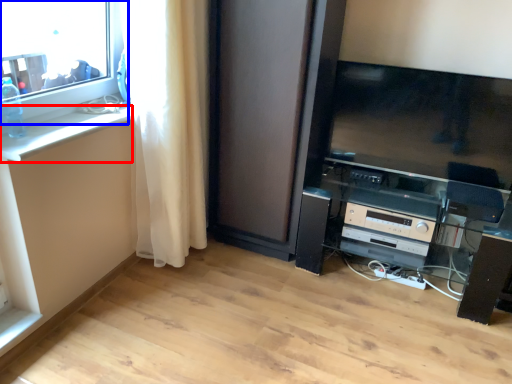
Question: Which object is closer to the camera taking this photo, counter top (highlighted by a red box) or window (highlighted by a blue box)?

Choices:
 (A) counter top
 (B) window

Answer: (B)